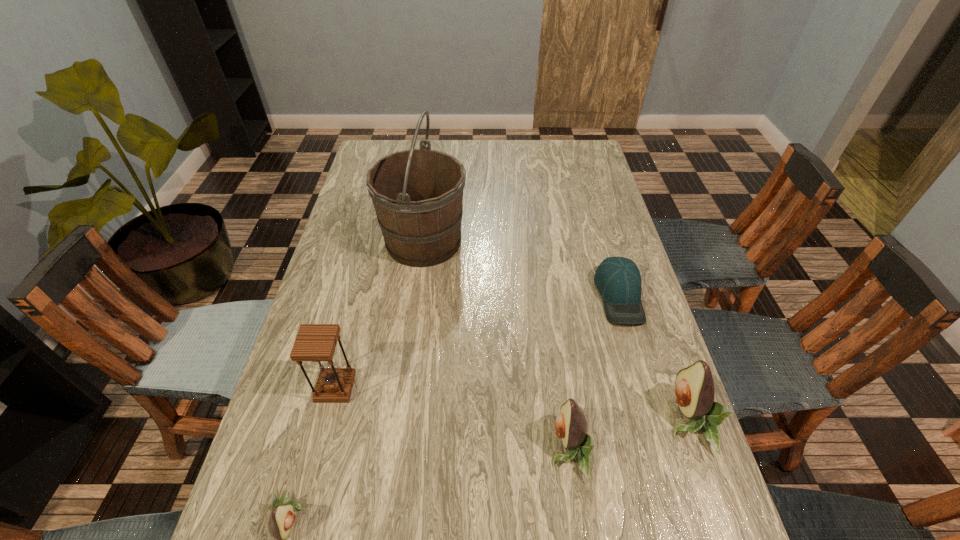
Where is `vacant point located between the shortest object and the hourglass`? vacant point located between the shortest object and the hourglass is located at coordinates click(477, 341).

The image size is (960, 540). Identify the location of vacant area that lies between the hourglass and the shortest object. (477, 341).

Find the location of `the closest object to the nearest object`. the closest object to the nearest object is located at coordinates (314, 342).

Find the location of `object that is the fifth closest to the bucket`. object that is the fifth closest to the bucket is located at coordinates (282, 517).

The height and width of the screenshot is (540, 960). Find the location of `avocado that is the second closest to the fifth tallest object`. avocado that is the second closest to the fifth tallest object is located at coordinates (694, 388).

At what (x,y) coordinates should I click in order to perform the action: click on avocado that is the third closest to the tallest object. Please return your answer as a coordinate pair (x, y). The image size is (960, 540). Looking at the image, I should click on (x=282, y=517).

Locate an element on the screen. The width and height of the screenshot is (960, 540). vacant region that satisfies the following two spatial constraints: 1. on the front side of the shortest object; 2. on the seed side of the second avocado from left to right is located at coordinates (664, 449).